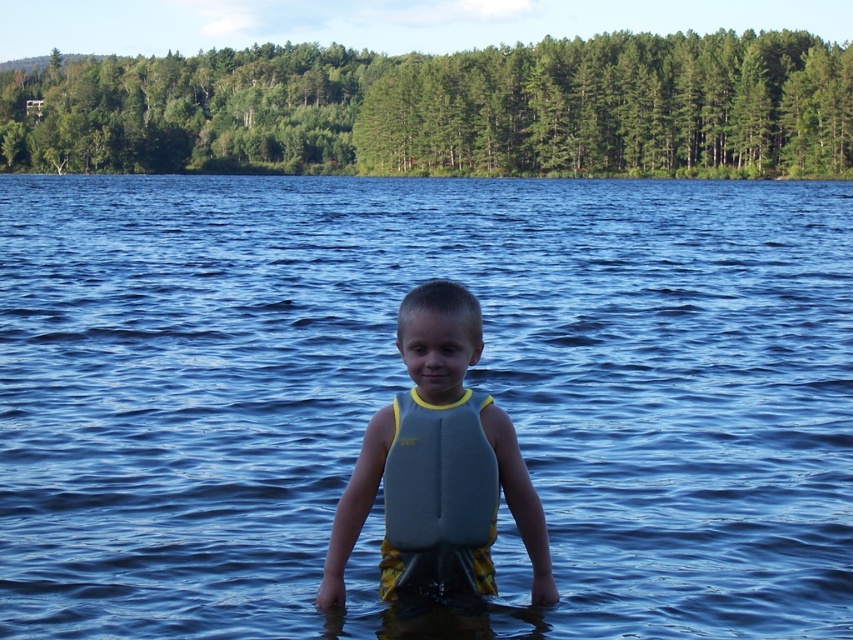
Question: Estimate the real-world distances between objects in this image. Which object is closer to the blue water at center?

Choices:
 (A) gray/yellow fabric life vest at center
 (B) gray matte life jacket at center

Answer: (B)

Question: Is blue water at center thinner than gray/yellow fabric life vest at center?

Choices:
 (A) no
 (B) yes

Answer: (A)

Question: Where is blue water at center located in relation to gray/yellow fabric life vest at center in the image?

Choices:
 (A) below
 (B) above

Answer: (B)

Question: Based on their relative distances, which object is nearer to the gray matte life jacket at center?

Choices:
 (A) gray/yellow fabric life vest at center
 (B) blue water at center

Answer: (A)

Question: Which object appears closest to the camera in this image?

Choices:
 (A) blue water at center
 (B) gray/yellow fabric life vest at center

Answer: (B)

Question: Observing the image, what is the correct spatial positioning of gray/yellow fabric life vest at center in reference to gray matte life jacket at center?

Choices:
 (A) left
 (B) right

Answer: (B)